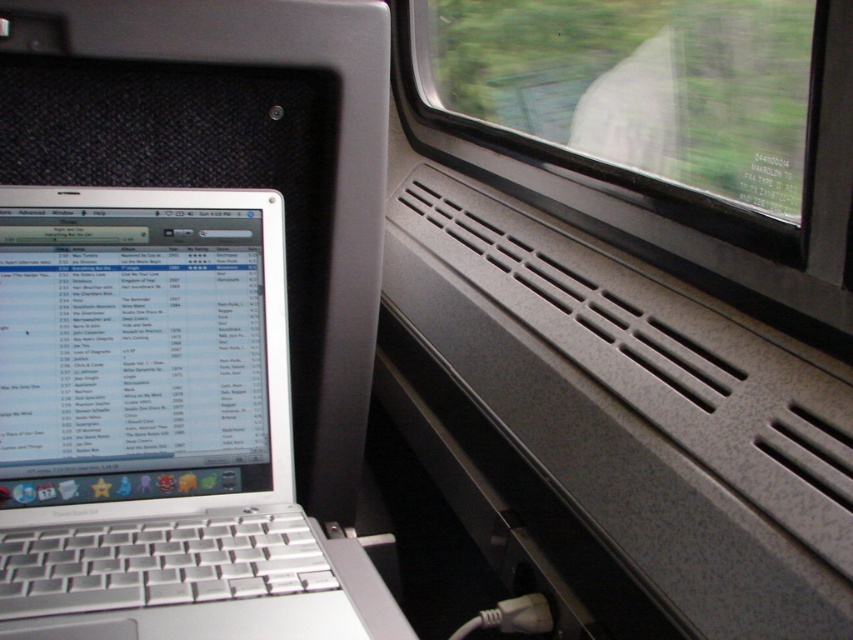
Question: Can you confirm if silver metallic laptop at left is bigger than transparent glass train window at upper center?

Choices:
 (A) no
 (B) yes

Answer: (A)

Question: Is silver metallic laptop at left positioned in front of transparent glass train window at upper center?

Choices:
 (A) no
 (B) yes

Answer: (B)

Question: Can you confirm if silver metallic laptop at left is positioned below transparent glass train window at upper center?

Choices:
 (A) no
 (B) yes

Answer: (B)

Question: Which point is farther to the camera?

Choices:
 (A) (634, 12)
 (B) (288, 588)

Answer: (A)

Question: Among these points, which one is farthest from the camera?

Choices:
 (A) (798, 154)
 (B) (254, 385)

Answer: (A)